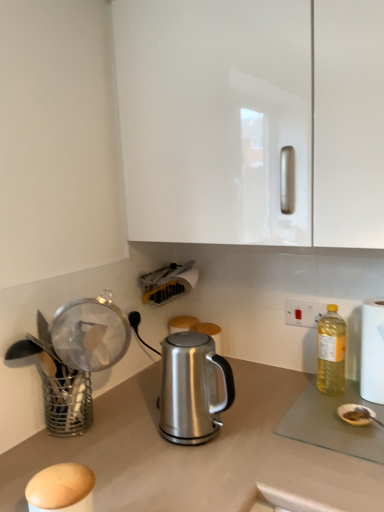
Question: From the image's perspective, does white plastic electric outlet at upper right appear lower than white glossy cabinet at upper center?

Choices:
 (A) no
 (B) yes

Answer: (B)

Question: Is white plastic electric outlet at upper right shorter than white glossy cabinet at upper center?

Choices:
 (A) yes
 (B) no

Answer: (A)

Question: Is white plastic electric outlet at upper right looking in the opposite direction of white glossy cabinet at upper center?

Choices:
 (A) no
 (B) yes

Answer: (A)

Question: Does white plastic electric outlet at upper right contain white glossy cabinet at upper center?

Choices:
 (A) yes
 (B) no

Answer: (B)

Question: From a real-world perspective, is white plastic electric outlet at upper right physically below white glossy cabinet at upper center?

Choices:
 (A) no
 (B) yes

Answer: (B)

Question: Do you think satin silver kettle at center is within white paper towel at right, or outside of it?

Choices:
 (A) inside
 (B) outside

Answer: (B)

Question: Looking at their shapes, would you say satin silver kettle at center is wider or thinner than white paper towel at right?

Choices:
 (A) thin
 (B) wide

Answer: (B)

Question: Relative to white paper towel at right, is satin silver kettle at center in front or behind?

Choices:
 (A) front
 (B) behind

Answer: (A)

Question: Based on their sizes in the image, would you say satin silver kettle at center is bigger or smaller than white paper towel at right?

Choices:
 (A) small
 (B) big

Answer: (B)

Question: Is white glossy cabinet at upper center to the left or to the right of white plastic electric outlet at upper right in the image?

Choices:
 (A) left
 (B) right

Answer: (A)

Question: Is point (135, 65) positioned closer to the camera than point (321, 313)?

Choices:
 (A) closer
 (B) farther

Answer: (A)

Question: Is white glossy cabinet at upper center spatially inside white plastic electric outlet at upper right, or outside of it?

Choices:
 (A) outside
 (B) inside

Answer: (A)

Question: From a real-world perspective, is white glossy cabinet at upper center physically located above or below white plastic electric outlet at upper right?

Choices:
 (A) above
 (B) below

Answer: (A)

Question: Looking at their shapes, would you say satin silver kettle at center is wider or thinner than white glossy cabinet at upper center?

Choices:
 (A) wide
 (B) thin

Answer: (B)

Question: Is satin silver kettle at center inside the boundaries of white glossy cabinet at upper center, or outside?

Choices:
 (A) inside
 (B) outside

Answer: (B)